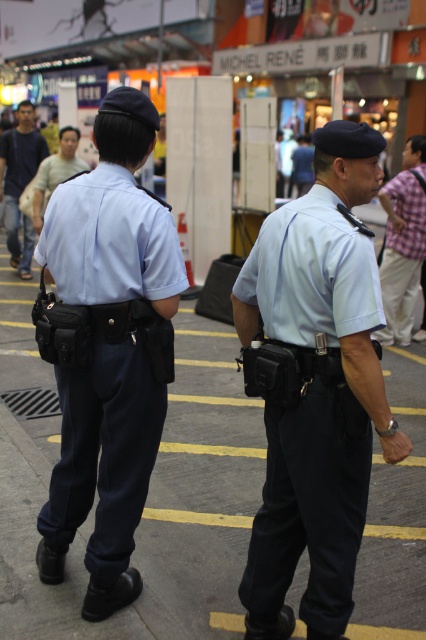
Locate an element on the screen. The image size is (426, 640). light brown leather jacket at upper left is located at coordinates (20, 180).

Measure the distance between light brown leather jacket at upper left and camera.

light brown leather jacket at upper left is 9.72 meters from camera.

Who is more distant from viewer, (2, 193) or (40, 172)?

Point (2, 193)

You are a GUI agent. You are given a task and a screenshot of the screen. Output one action in this format:
    pyautogui.click(x=<x>, y=<y>)
    Task: Click on the light brown leather jacket at upper left
    The image size is (426, 640).
    Given the screenshot: What is the action you would take?
    pyautogui.click(x=20, y=180)

Does light blue fabric shirt at center appear over light brown leather jacket at upper left?

Incorrect, light blue fabric shirt at center is not positioned above light brown leather jacket at upper left.

Is light blue fabric shirt at center in front of light brown leather jacket at upper left?

Yes, light blue fabric shirt at center is in front of light brown leather jacket at upper left.

This screenshot has height=640, width=426. Identify the location of light blue fabric shirt at center. (308, 408).

The height and width of the screenshot is (640, 426). Find the location of `light blue fabric shirt at center`. light blue fabric shirt at center is located at coordinates (308, 408).

Can you confirm if gray concrete pavement at center is wider than light blue fabric shirt at center?

Correct, the width of gray concrete pavement at center exceeds that of light blue fabric shirt at center.

Is gray concrete pavement at center thinner than light blue fabric shirt at center?

No.

Who is more forward, (169,556) or (325,237)?

Point (325,237) is in front.

Find the location of a particular element. The image size is (426, 640). gray concrete pavement at center is located at coordinates (149, 490).